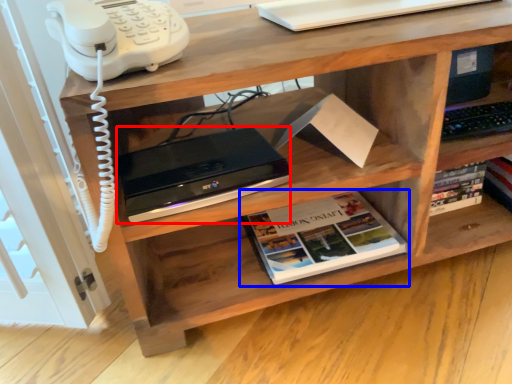
Question: Which point is closer to the camera, computer (highlighted by a red box) or book (highlighted by a blue box)?

Choices:
 (A) computer
 (B) book

Answer: (A)